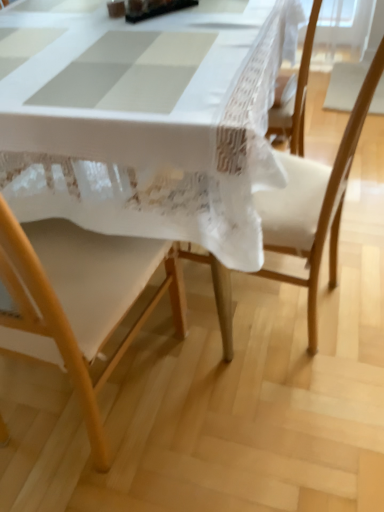
This screenshot has width=384, height=512. What are the coordinates of `vacant area that lies to the right of wooden chair at lower left, acting as the 2th chair starting from the right` in the screenshot? It's located at (226, 409).